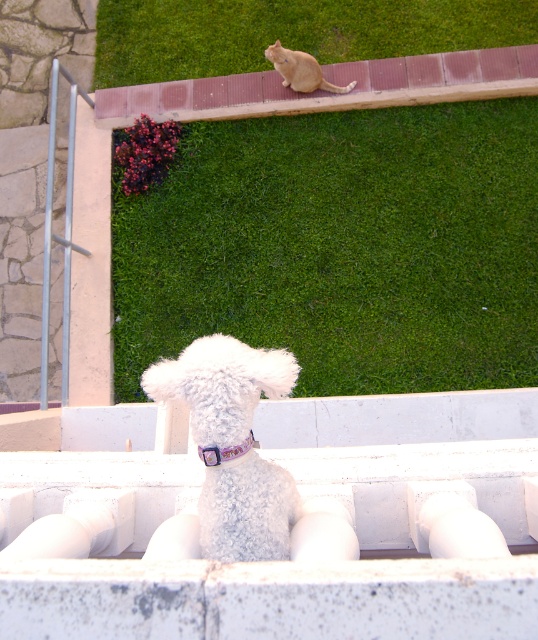
You are a gardener holding a 5 meter long hose. You see the white fluffy dog at upper center and the purple satin neckband at center. Can you reach both objects with the hose without moving the hose? Please explain your reasoning.

The white fluffy dog at upper center and the purple satin neckband at center are 4.77 meters apart. Since the hose is 5 meters long, which is longer than the distance between them, you can reach both objects with the hose without moving it.

Looking at this image, you are a photographer trying to capture both the white fluffy dog at center and the purple satin neckband at center in a single frame. Which object will appear larger in your photo?

The white fluffy dog at center will appear larger in the photo since it is bigger than the purple satin neckband at center according to the description.